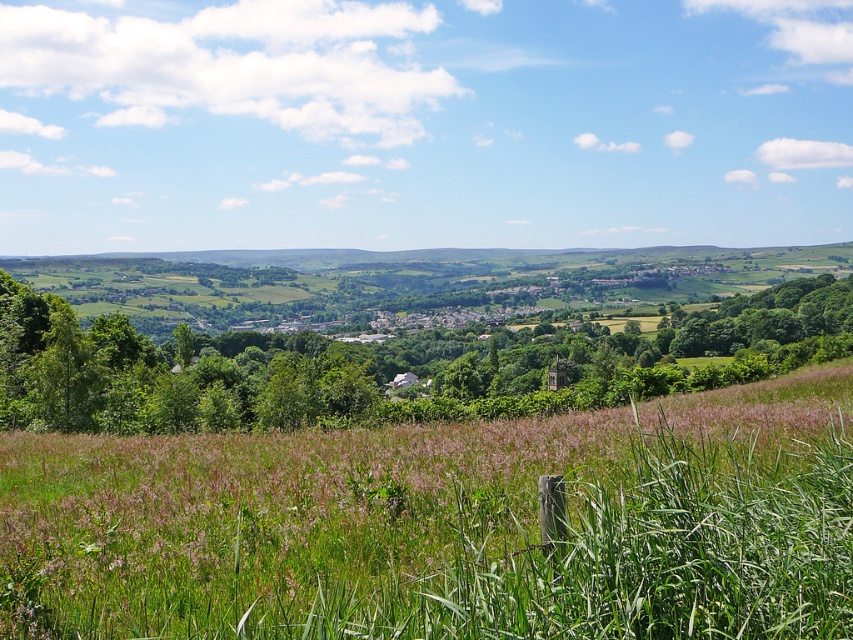
Question: Which object is closer to the camera taking this photo?

Choices:
 (A) green grass at center
 (B) green leafy tree at center

Answer: (A)

Question: Is green grass at center to the right of green leafy tree at center from the viewer's perspective?

Choices:
 (A) yes
 (B) no

Answer: (A)

Question: Is the position of green grass at center less distant than that of green leafy tree at center?

Choices:
 (A) no
 (B) yes

Answer: (B)

Question: Which object is closer to the camera taking this photo?

Choices:
 (A) green leafy tree at center
 (B) green grass at center

Answer: (B)

Question: Observing the image, what is the correct spatial positioning of green grass at center in reference to green leafy tree at center?

Choices:
 (A) below
 (B) above

Answer: (A)

Question: Which point is closer to the camera?

Choices:
 (A) (193, 333)
 (B) (776, 483)

Answer: (B)